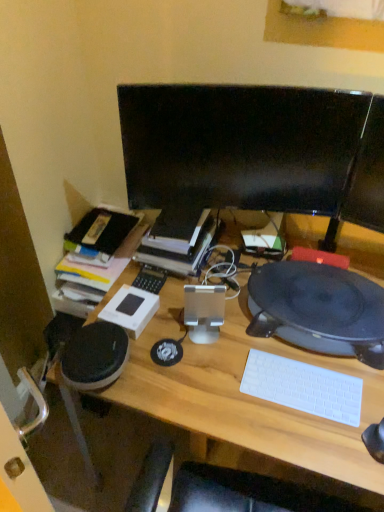
What are the coordinates of `free space to the left of white plastic keyboard at lower right` in the screenshot? It's located at (222, 388).